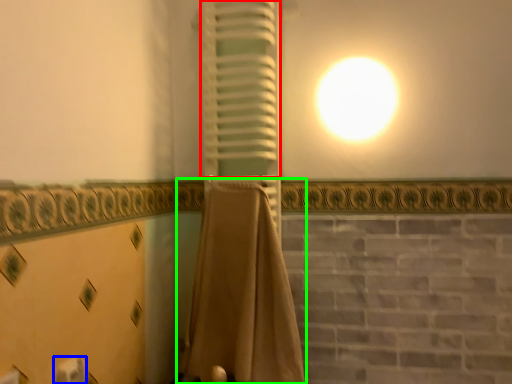
Question: Based on their relative distances, which object is farther from curtain (highlighted by a red box)? Choose from toilet paper (highlighted by a blue box) and curtain (highlighted by a green box).

Choices:
 (A) toilet paper
 (B) curtain

Answer: (A)